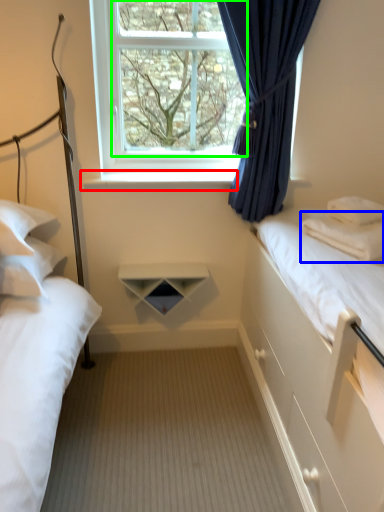
Question: Which is farther away from window sill (highlighted by a red box)? pillow (highlighted by a blue box) or window screen (highlighted by a green box)?

Choices:
 (A) pillow
 (B) window screen

Answer: (A)